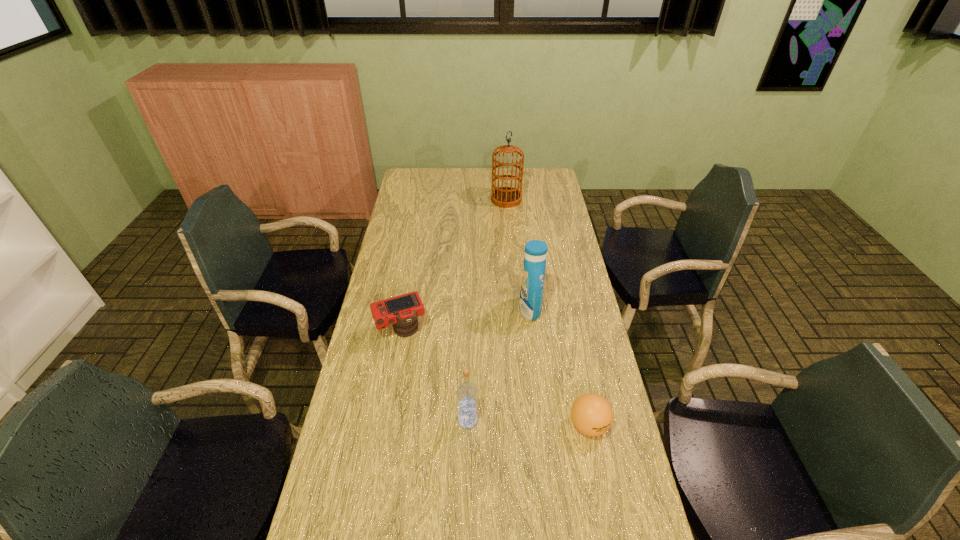
Locate an element on the screen. This screenshot has width=960, height=540. the tallest object is located at coordinates (506, 197).

At what (x,y) coordinates should I click in order to perform the action: click on birdcage. Please return your answer as a coordinate pair (x, y). The width and height of the screenshot is (960, 540). Looking at the image, I should click on (506, 197).

Where is `the second tallest object`? the second tallest object is located at coordinates (532, 283).

At what (x,y) coordinates should I click in order to perform the action: click on vodka. Please return your answer as a coordinate pair (x, y). The image size is (960, 540). Looking at the image, I should click on (466, 393).

Find the location of a particular element. The width and height of the screenshot is (960, 540). the fourth object from right to left is located at coordinates coord(466,393).

Locate an element on the screen. camera is located at coordinates (401, 311).

At what (x,y) coordinates should I click in order to perform the action: click on the rightmost object. Please return your answer as a coordinate pair (x, y). Image resolution: width=960 pixels, height=540 pixels. Looking at the image, I should click on (591, 414).

Where is `free space located 0.110m on the right of the birdcage`? The height and width of the screenshot is (540, 960). free space located 0.110m on the right of the birdcage is located at coordinates (543, 200).

At what (x,y) coordinates should I click in order to perform the action: click on vacant position located on the front-facing side of the detergent. Please return your answer as a coordinate pair (x, y). The height and width of the screenshot is (540, 960). Looking at the image, I should click on (489, 310).

Identify the location of vacant space situated 0.150m on the front-facing side of the detergent. (478, 310).